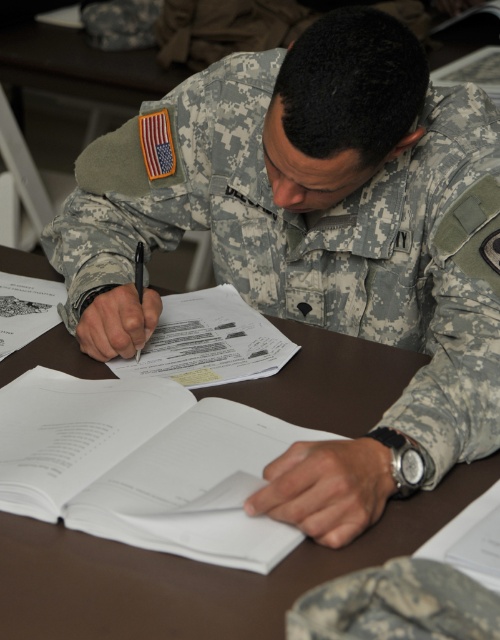
Question: Can you confirm if camouflage fabric uniform at center is thinner than brown wooden table at center?

Choices:
 (A) yes
 (B) no

Answer: (A)

Question: Can you confirm if camouflage fabric uniform at center is bigger than white paper book at center?

Choices:
 (A) no
 (B) yes

Answer: (B)

Question: Among these objects, which one is farthest from the camera?

Choices:
 (A) white paper book at center
 (B) camouflage fabric uniform at center
 (C) brown wooden table at center

Answer: (B)

Question: Estimate the real-world distances between objects in this image. Which object is closer to the white paper book at center?

Choices:
 (A) camouflage fabric uniform at center
 (B) brown wooden table at center

Answer: (B)

Question: Is camouflage fabric uniform at center positioned at the back of brown wooden table at center?

Choices:
 (A) yes
 (B) no

Answer: (A)

Question: Estimate the real-world distances between objects in this image. Which object is closer to the white paper book at center?

Choices:
 (A) camouflage fabric uniform at center
 (B) brown wooden table at center

Answer: (B)